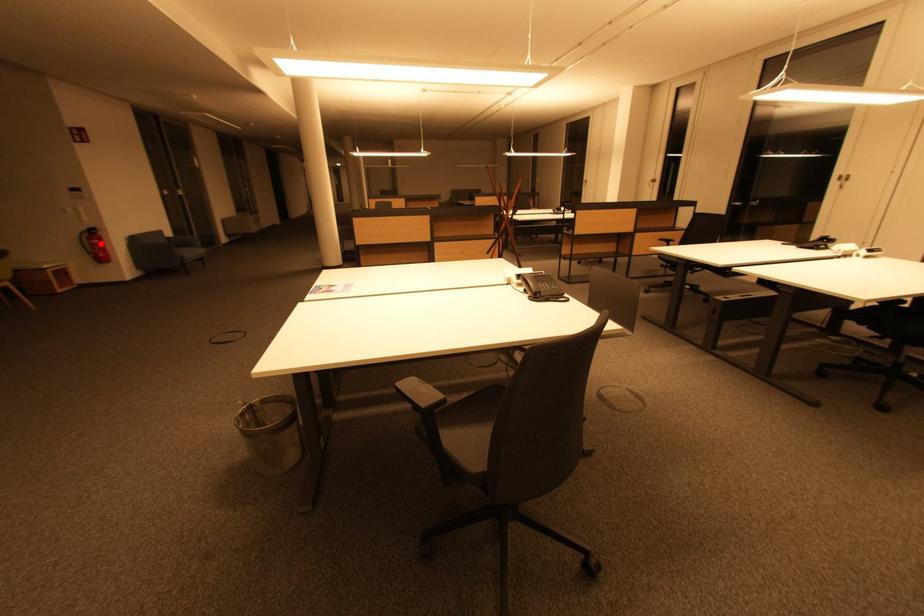
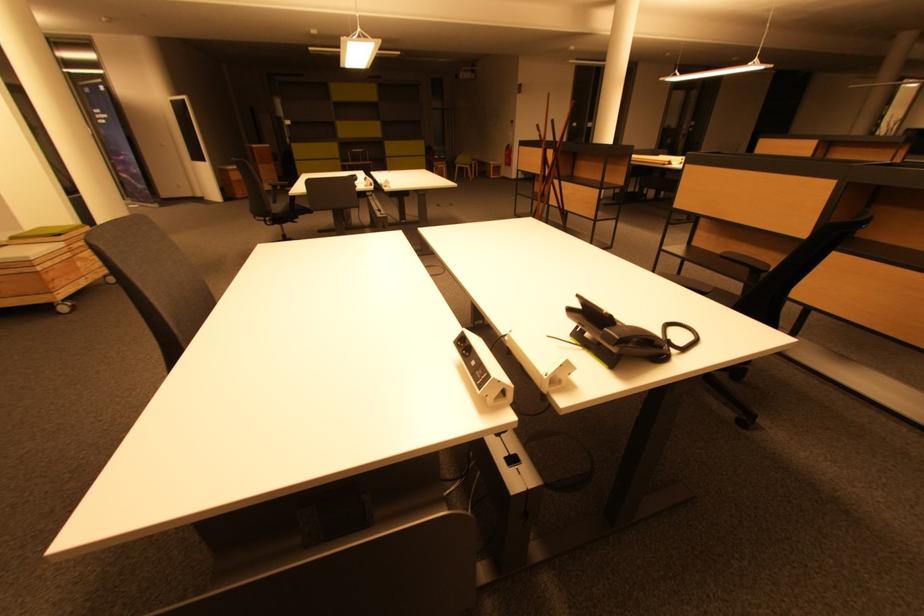
Question: I am providing you with two images of the same scene from different viewpoints. A red point is shown in image1. For the corresponding object point in image2, is it positioned nearer or farther from the camera?

Choices:
 (A) Nearer
 (B) Farther

Answer: (A)